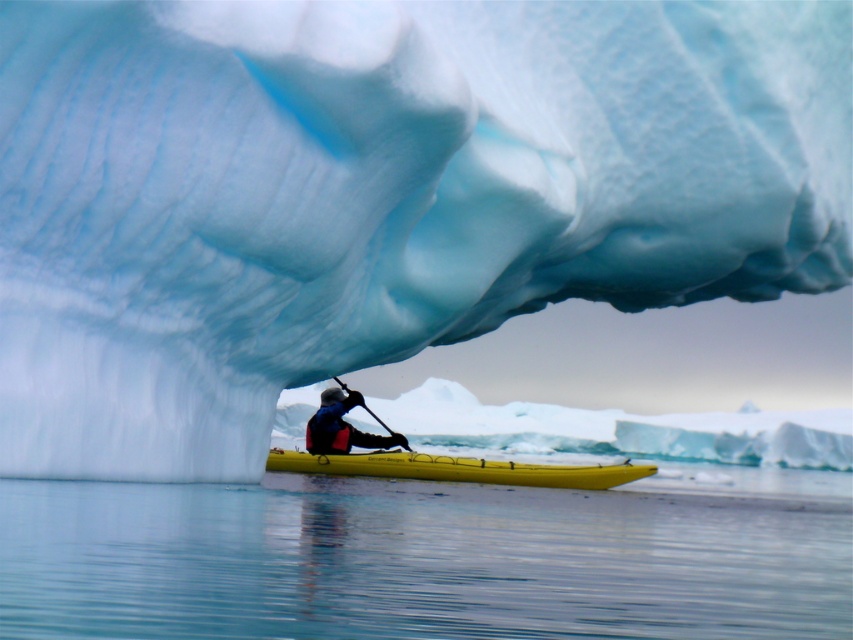
Which of these two, yellow matte canoe at center or black rubber paddle at center, stands taller?

Standing taller between the two is black rubber paddle at center.

Does yellow matte canoe at center come behind black rubber paddle at center?

That is False.

Is point (573, 484) positioned before point (397, 433)?

Yes, it is.

Image resolution: width=853 pixels, height=640 pixels. Identify the location of yellow matte canoe at center. (456, 468).

The height and width of the screenshot is (640, 853). I want to click on transparent water at lower center, so 413,561.

The width and height of the screenshot is (853, 640). I want to click on transparent water at lower center, so click(x=413, y=561).

Is point (482, 636) farther from camera compared to point (378, 419)?

No.

Is transparent water at lower center positioned behind black rubber paddle at center?

No, it is in front of black rubber paddle at center.

Image resolution: width=853 pixels, height=640 pixels. What do you see at coordinates (413, 561) in the screenshot? I see `transparent water at lower center` at bounding box center [413, 561].

Where is `transparent water at lower center`? This screenshot has width=853, height=640. transparent water at lower center is located at coordinates (413, 561).